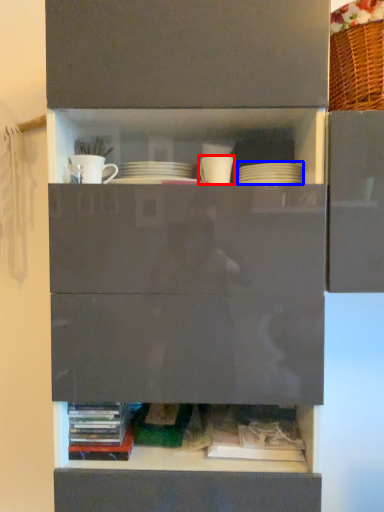
Question: Which of the following is the farthest to the observer, tableware (highlighted by a red box) or tableware (highlighted by a blue box)?

Choices:
 (A) tableware
 (B) tableware

Answer: (A)